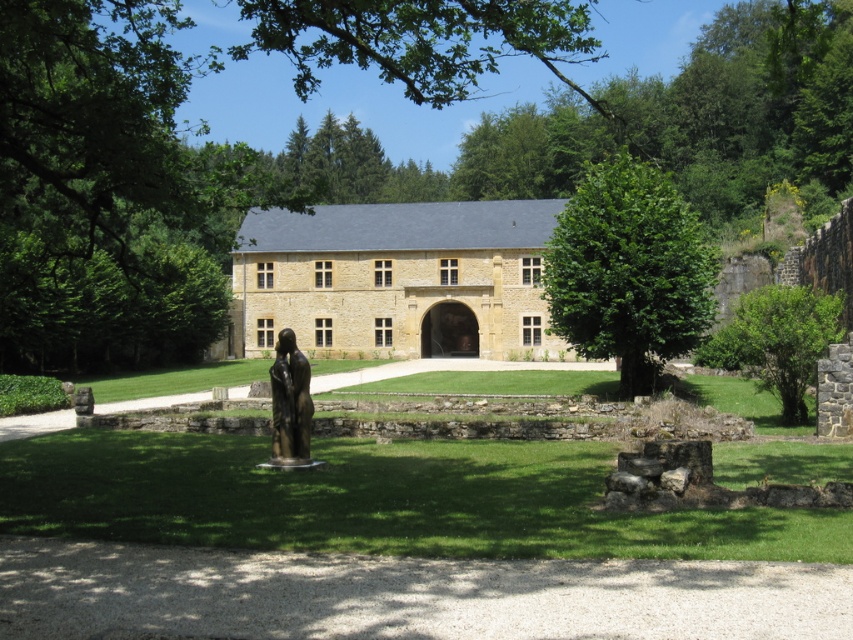
Measure the distance between point [627,349] and camera.

48.18 meters

Which is below, green leafy tree at center or bronze statue at center?

Positioned lower is bronze statue at center.

Locate an element on the screen. Image resolution: width=853 pixels, height=640 pixels. green leafy tree at center is located at coordinates (628, 272).

The width and height of the screenshot is (853, 640). I want to click on green leafy tree at center, so click(x=628, y=272).